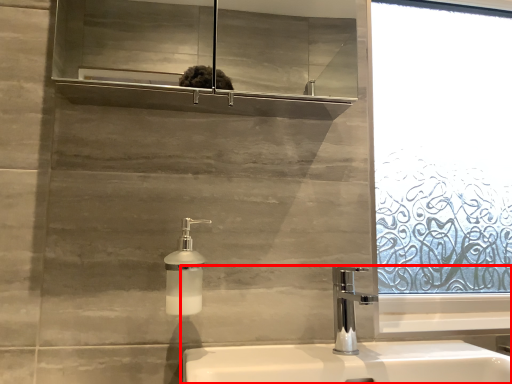
Question: In this image, where is sink (annotated by the red box) located relative to soap dispenser?

Choices:
 (A) left
 (B) right

Answer: (B)